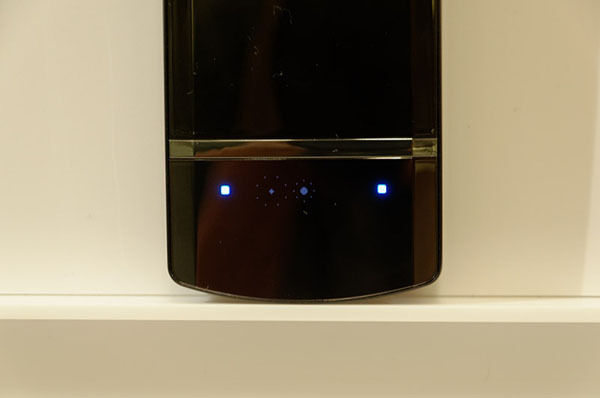
The height and width of the screenshot is (398, 600). In order to click on glare from lighting up top in this screenshot , I will do `click(100, 302)`.